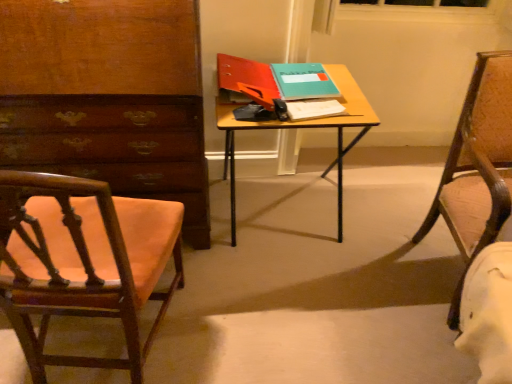
Find the location of a particular element. The width and height of the screenshot is (512, 384). vacant area situated below wooden desk at center (from a real-world perspective) is located at coordinates (279, 218).